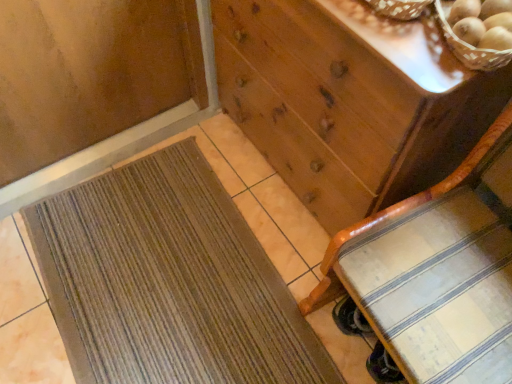
At what (x,y) coordinates should I click in order to perform the action: click on blank space situated above brown textured mat at lower left (from a real-world perspective). Please return your answer as a coordinate pair (x, y). The height and width of the screenshot is (384, 512). Looking at the image, I should click on (165, 275).